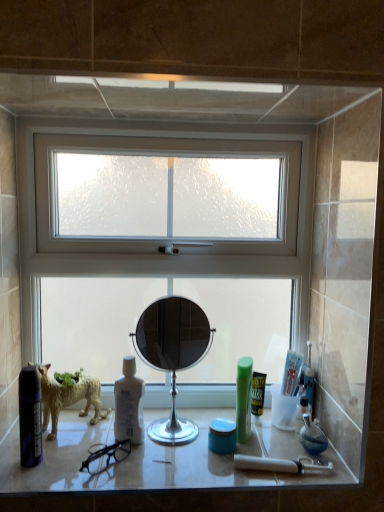
Identify the location of free point behind silver/metallic mirror at center. (182, 411).